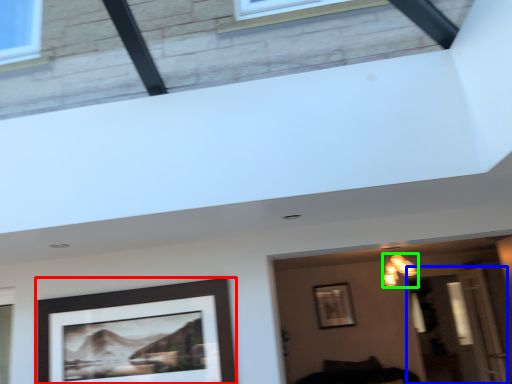
Question: Which is farther away from picture frame (highlighted by a red box)? glass door (highlighted by a blue box) or light fixture (highlighted by a green box)?

Choices:
 (A) glass door
 (B) light fixture

Answer: (A)